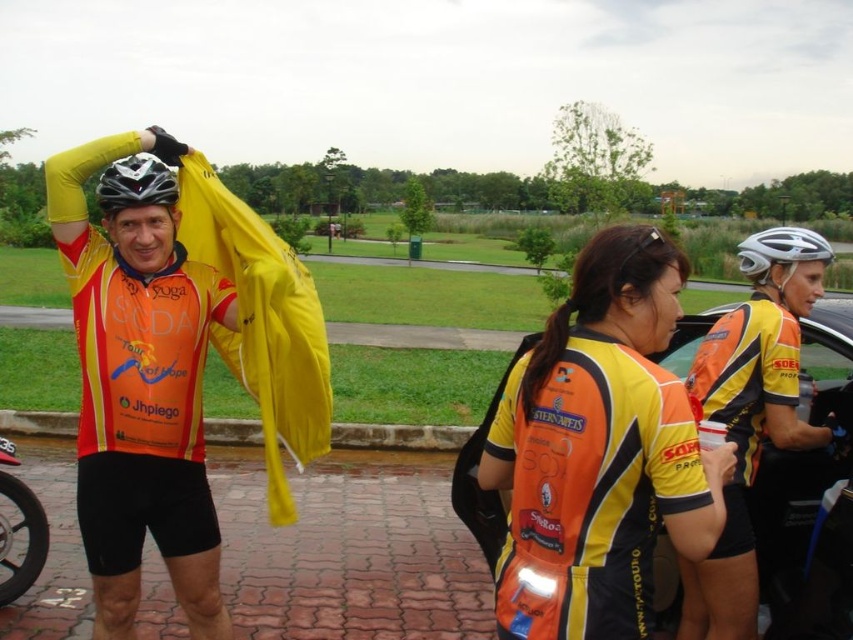
From the picture: You are a photographer trying to capture a photo of the orange jersey at center and the white matte bicycle helmet at upper right. If your camera has a maximum focus range of 3 feet, can you focus on both objects without moving your position?

The distance between the orange jersey at center and the white matte bicycle helmet at upper right is 3.63 feet. Since the camera can only focus up to 3 feet, the objects are too far apart for both to be in focus simultaneously.